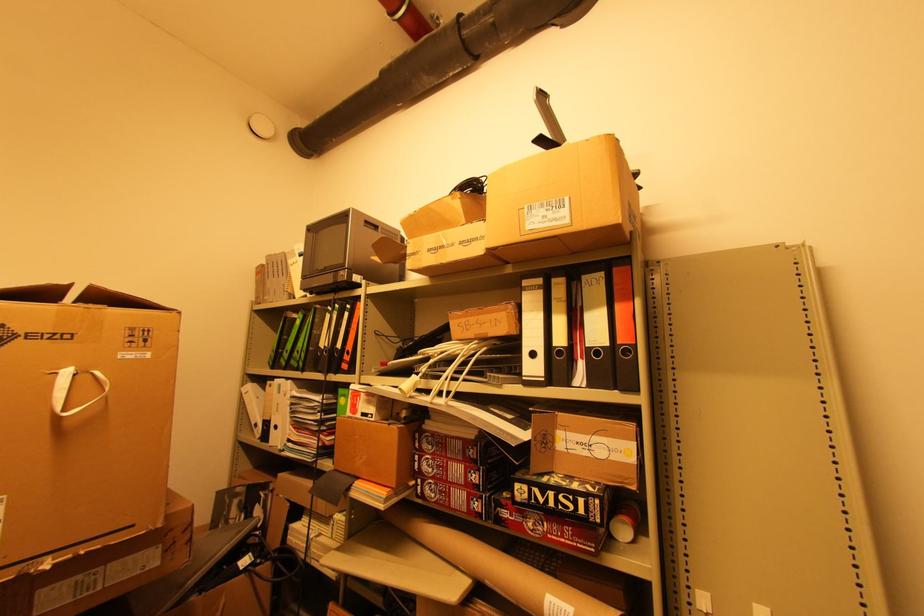
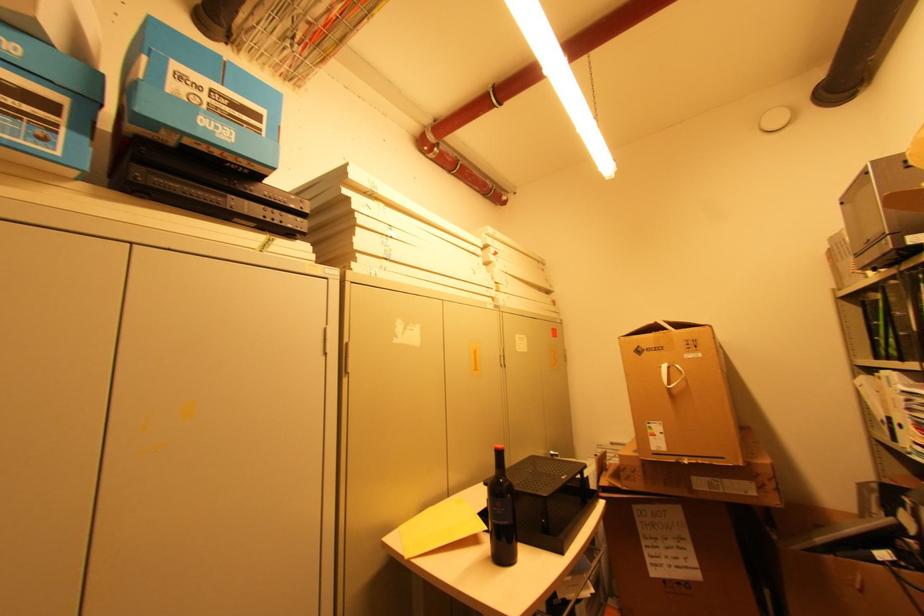
Locate, in the second image, the point that corresponds to the point at 61,419 in the first image.

(672, 390)